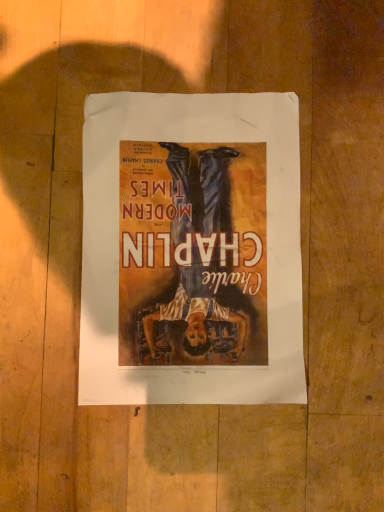
The height and width of the screenshot is (512, 384). Describe the element at coordinates (191, 250) in the screenshot. I see `matte paper poster at center` at that location.

I want to click on matte paper poster at center, so click(x=191, y=250).

What is the approximate height of matte paper poster at center?

matte paper poster at center is 0.39 inches tall.

Where is `matte paper poster at center`? matte paper poster at center is located at coordinates (191, 250).